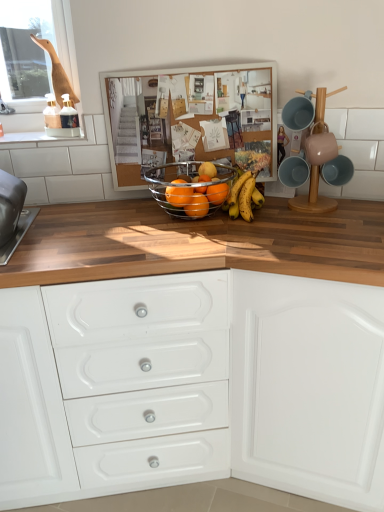
Find the location of a particular element. The height and width of the screenshot is (512, 384). free space in front of yellow matte bananas at center is located at coordinates (246, 233).